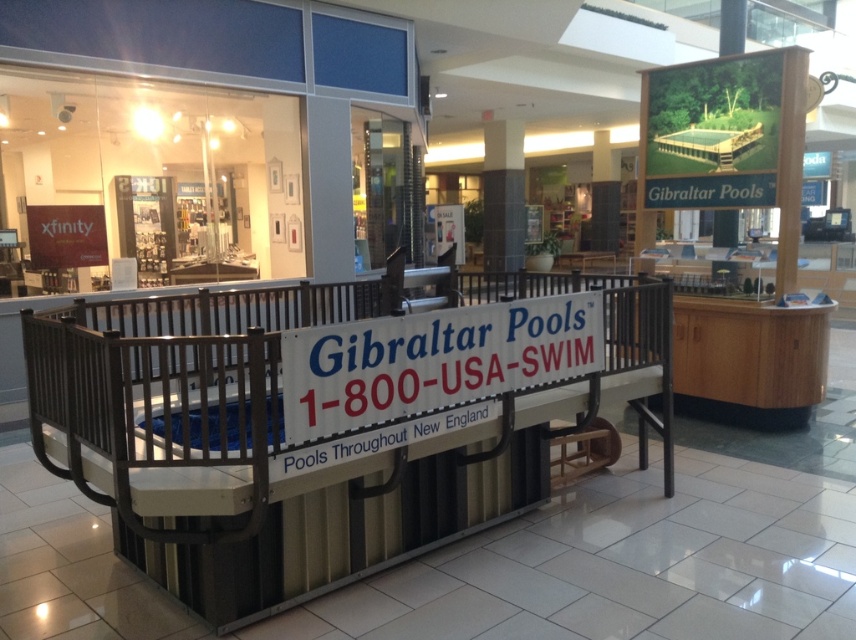
You are a customer at the mall looking at the Gibraltar Pools promotional display. You notice the metallic gray balustrade at center and the white plastic sign at center. Which object is bigger in size?

The metallic gray balustrade at center is larger in size compared to the white plastic sign at center.

You are a customer at the mall looking at the Gibraltar Pools display. You notice the metallic gray balustrade at center and the white plastic sign at center. Which object is positioned higher in the display?

The white plastic sign at center is positioned higher than the metallic gray balustrade at center.

You are a customer at the mall and want to know if the metallic gray balustrade at center is wider than the white plastic sign at center. Can you determine this based on the display?

The metallic gray balustrade at center is wider than the white plastic sign at center according to the description.